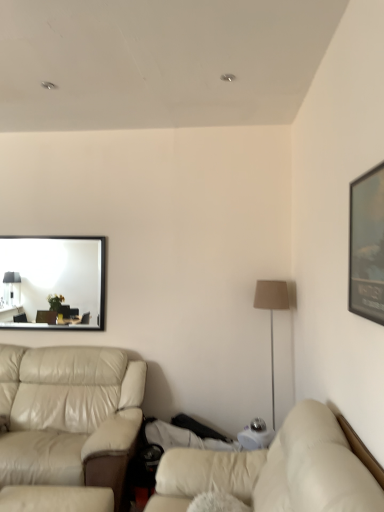
Question: Is matte black picture frame at upper right beside matte black mirror at upper left?

Choices:
 (A) no
 (B) yes

Answer: (A)

Question: Would you say matte black picture frame at upper right is a long distance from matte black mirror at upper left?

Choices:
 (A) no
 (B) yes

Answer: (B)

Question: Is matte black picture frame at upper right not within matte black mirror at upper left?

Choices:
 (A) yes
 (B) no

Answer: (A)

Question: Is matte black picture frame at upper right facing away from matte black mirror at upper left?

Choices:
 (A) no
 (B) yes

Answer: (A)

Question: Does matte black picture frame at upper right have a lesser width compared to matte black mirror at upper left?

Choices:
 (A) yes
 (B) no

Answer: (A)

Question: From a real-world perspective, is beige fabric floor lamp at right positioned above or below matte black picture frame at upper right?

Choices:
 (A) below
 (B) above

Answer: (A)

Question: Is beige fabric floor lamp at right bigger or smaller than matte black picture frame at upper right?

Choices:
 (A) small
 (B) big

Answer: (B)

Question: Relative to matte black picture frame at upper right, is beige fabric floor lamp at right in front or behind?

Choices:
 (A) front
 (B) behind

Answer: (B)

Question: Is beige fabric floor lamp at right to the left or to the right of matte black picture frame at upper right in the image?

Choices:
 (A) left
 (B) right

Answer: (A)

Question: From the image's perspective, is matte black picture frame at upper right located above or below beige leather studio couch at left, acting as the first studio couch starting from the left?

Choices:
 (A) below
 (B) above

Answer: (B)

Question: Which is correct: matte black picture frame at upper right is inside beige leather studio couch at left, positioned as the first studio couch in back-to-front order, or outside of it?

Choices:
 (A) inside
 (B) outside

Answer: (B)

Question: Looking at the image, does matte black picture frame at upper right seem bigger or smaller compared to beige leather studio couch at left, positioned as the first studio couch in back-to-front order?

Choices:
 (A) big
 (B) small

Answer: (B)

Question: Is point (380, 219) positioned closer to the camera than point (4, 439)?

Choices:
 (A) farther
 (B) closer

Answer: (B)

Question: Looking at their shapes, would you say beige fabric floor lamp at right is wider or thinner than beige leather studio couch at left, positioned as the first studio couch in back-to-front order?

Choices:
 (A) thin
 (B) wide

Answer: (A)

Question: Considering the positions of point (279, 288) and point (104, 460), is point (279, 288) closer or farther from the camera than point (104, 460)?

Choices:
 (A) farther
 (B) closer

Answer: (A)